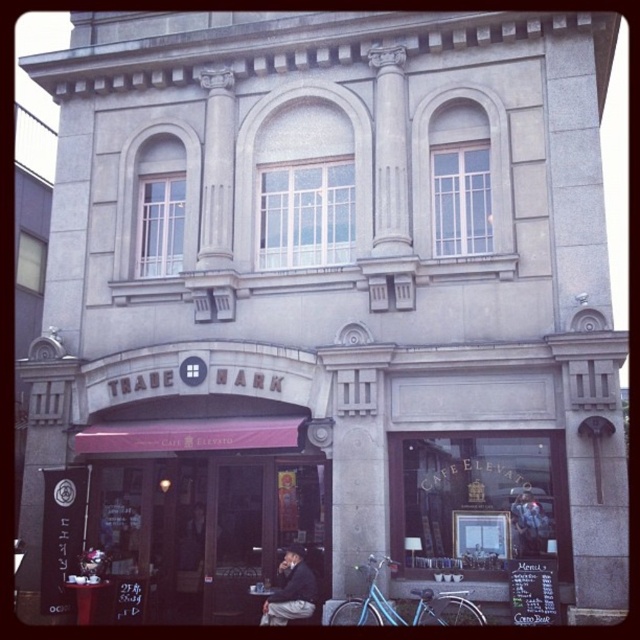
Question: Is matte pink awning at lower left bigger than dark gray suit at center?

Choices:
 (A) yes
 (B) no

Answer: (B)

Question: Which object is the closest to the dark gray suit at center?

Choices:
 (A) dark gray jacket at center
 (B) matte pink awning at lower left

Answer: (A)

Question: Can you confirm if dark gray suit at center is positioned to the right of dark gray jacket at center?

Choices:
 (A) yes
 (B) no

Answer: (A)

Question: Is matte pink awning at lower left above dark gray jacket at center?

Choices:
 (A) no
 (B) yes

Answer: (A)

Question: Among these points, which one is nearest to the camera?

Choices:
 (A) (321, 538)
 (B) (188, 561)

Answer: (A)

Question: Which object is the closest to the dark gray jacket at center?

Choices:
 (A) matte pink awning at lower left
 (B) dark gray suit at center

Answer: (A)